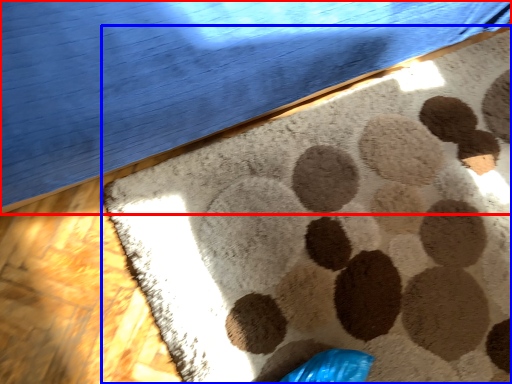
Question: Which object appears closest to the camera in this image, furniture (highlighted by a red box) or mat (highlighted by a blue box)?

Choices:
 (A) furniture
 (B) mat

Answer: (A)